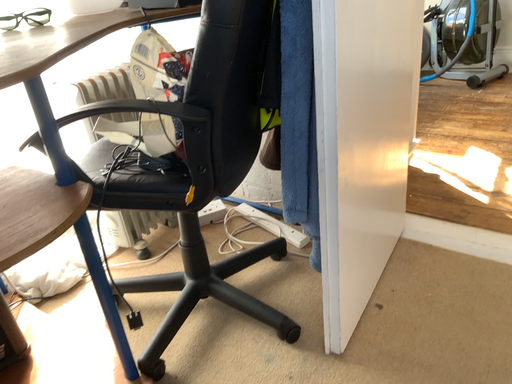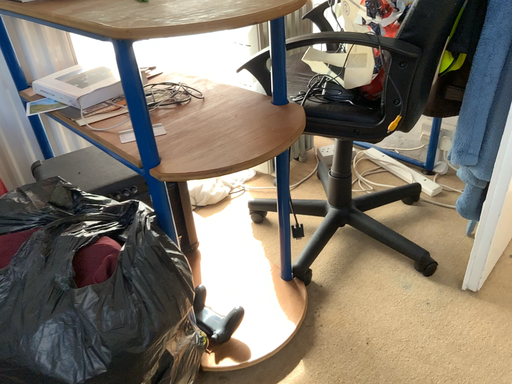
Question: How did the camera likely rotate when shooting the video?

Choices:
 (A) rotated right
 (B) rotated left

Answer: (B)